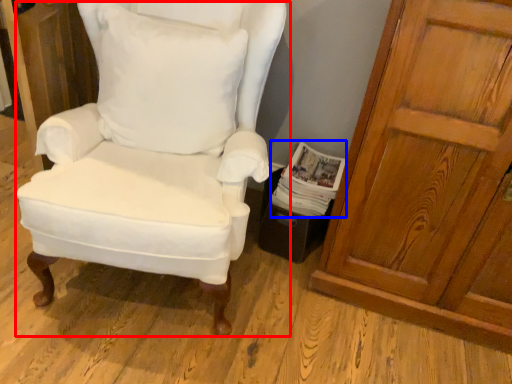
Question: Among these objects, which one is nearest to the camera, chair (highlighted by a red box) or magazine (highlighted by a blue box)?

Choices:
 (A) chair
 (B) magazine

Answer: (A)